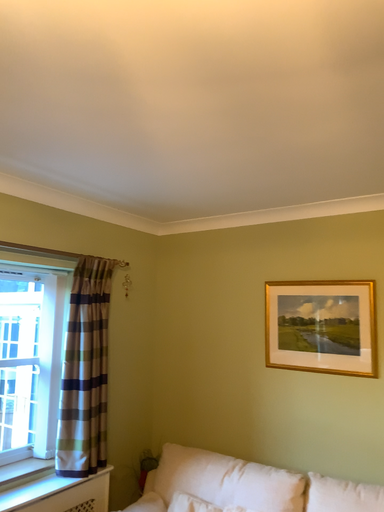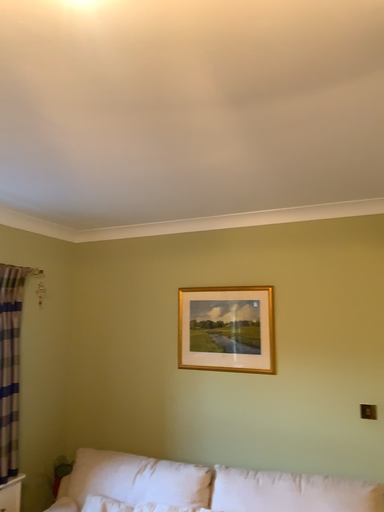
Question: How did the camera likely rotate when shooting the video?

Choices:
 (A) rotated right
 (B) rotated left

Answer: (A)